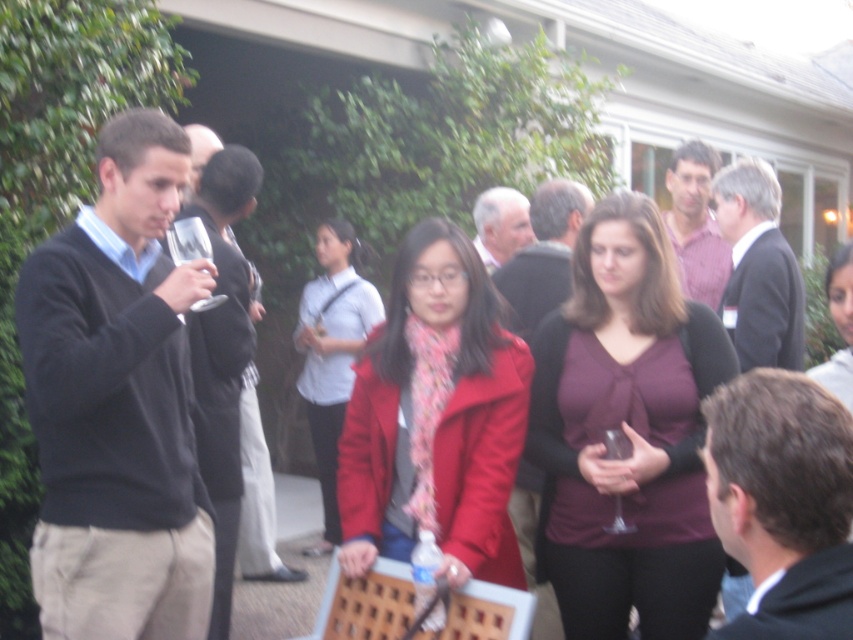
Question: Can you confirm if dark gray sweater at left is positioned below matte pink shirt at upper right?

Choices:
 (A) no
 (B) yes

Answer: (B)

Question: Can you confirm if light gray hair at center is bigger than clear glass wine glass at center?

Choices:
 (A) yes
 (B) no

Answer: (A)

Question: Which object is the farthest from the matte pink shirt at upper right?

Choices:
 (A) matte purple blouse at center
 (B) dark gray sweater at left
 (C) light gray hair at center
 (D) dark brown hair at center

Answer: (D)

Question: Which of the following is the farthest from the observer?

Choices:
 (A) (419, 396)
 (B) (526, 200)
 (C) (752, 628)
 (D) (772, 230)

Answer: (B)

Question: Which of the following is the farthest from the observer?

Choices:
 (A) (502, 467)
 (B) (618, 458)

Answer: (A)

Question: From the image, what is the correct spatial relationship of dark gray sweater at left in relation to light gray hair at center?

Choices:
 (A) above
 (B) below

Answer: (B)